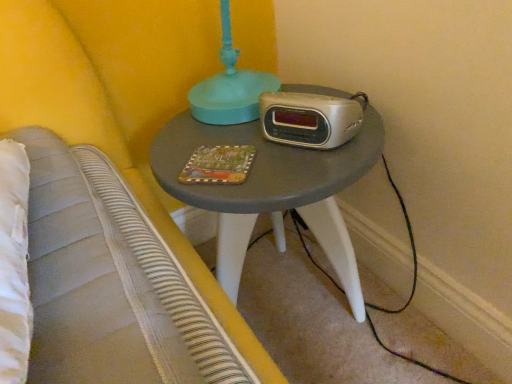
Where is `silver metallic clock radio at center`? silver metallic clock radio at center is located at coordinates (309, 119).

The height and width of the screenshot is (384, 512). Identify the location of silver metallic clock radio at center. (309, 119).

From the image's perspective, which is above, matte gray table at center or silver metallic clock radio at center?

silver metallic clock radio at center appears higher in the image.

From a real-world perspective, is matte gray table at center physically above silver metallic clock radio at center?

No, from a real-world perspective, matte gray table at center is not over silver metallic clock radio at center

Could you tell me if matte gray table at center is turned towards silver metallic clock radio at center?

No, matte gray table at center is not oriented towards silver metallic clock radio at center.

Locate an element on the screen. stereo behind the matte gray table at center is located at coordinates (309, 119).

Considering the sizes of matte gray table at center and matte painted wood book at center in the image, is matte gray table at center wider or thinner than matte painted wood book at center?

matte gray table at center is wider than matte painted wood book at center.

Is matte gray table at center to the right of matte painted wood book at center from the viewer's perspective?

Yes.

Between point (367, 163) and point (211, 161), which one is positioned behind?

The point (211, 161) is more distant.

Considering the sizes of objects matte gray table at center and matte painted wood book at center in the image provided, who is bigger, matte gray table at center or matte painted wood book at center?

Bigger between the two is matte gray table at center.

Is matte painted wood book at center situated inside matte gray table at center or outside?

matte painted wood book at center is inside matte gray table at center.

Considering the sizes of objects matte painted wood book at center and matte gray table at center in the image provided, who is wider, matte painted wood book at center or matte gray table at center?

matte gray table at center is wider.

How different are the orientations of matte painted wood book at center and matte gray table at center in degrees?

49.4 degrees separate the facing orientations of matte painted wood book at center and matte gray table at center.

From the picture: Is matte painted wood book at center to the left of silver metallic clock radio at center from the viewer's perspective?

Yes.

From the picture: From the image's perspective, is matte painted wood book at center located beneath silver metallic clock radio at center?

Correct, matte painted wood book at center appears lower than silver metallic clock radio at center in the image.

Is matte painted wood book at center shorter than silver metallic clock radio at center?

Correct, matte painted wood book at center is not as tall as silver metallic clock radio at center.

Are silver metallic clock radio at center and matte painted wood book at center located far from each other?

That's not correct — silver metallic clock radio at center is a little close to matte painted wood book at center.

Which of these two, silver metallic clock radio at center or matte painted wood book at center, is bigger?

silver metallic clock radio at center.

Is matte painted wood book at center surrounded by silver metallic clock radio at center?

That's incorrect, matte painted wood book at center is not inside silver metallic clock radio at center.

Is silver metallic clock radio at center bigger than matte gray table at center?

No, silver metallic clock radio at center is not bigger than matte gray table at center.

Can you confirm if silver metallic clock radio at center is positioned to the left of matte gray table at center?

No, silver metallic clock radio at center is not to the left of matte gray table at center.

Is silver metallic clock radio at center shorter than matte gray table at center?

Yes, silver metallic clock radio at center is shorter than matte gray table at center.

Identify the location of nightstand lying below the silver metallic clock radio at center (from the image's perspective). (272, 191).

Where is `stereo on the right side of matte gray table at center`? stereo on the right side of matte gray table at center is located at coordinates (309, 119).

Find the location of a particular element. This screenshot has height=384, width=512. book that is behind the matte gray table at center is located at coordinates (218, 165).

From the image, which object appears to be farther from matte gray table at center, matte painted wood book at center or silver metallic clock radio at center?

matte painted wood book at center is further to matte gray table at center.

Estimate the real-world distances between objects in this image. Which object is further from matte painted wood book at center, matte gray table at center or silver metallic clock radio at center?

Among the two, matte gray table at center is located further to matte painted wood book at center.

Looking at the image, which one is located further to silver metallic clock radio at center, matte gray table at center or matte painted wood book at center?

matte gray table at center.

Based on their spatial positions, is silver metallic clock radio at center or matte gray table at center closer to matte painted wood book at center?

silver metallic clock radio at center.

Considering their positions, is silver metallic clock radio at center positioned further to matte gray table at center than matte painted wood book at center?

matte painted wood book at center is further to matte gray table at center.

Considering their positions, is matte painted wood book at center positioned further to silver metallic clock radio at center than matte gray table at center?

matte gray table at center is further to silver metallic clock radio at center.

Locate an element on the screen. book between silver metallic clock radio at center and matte gray table at center from top to bottom is located at coordinates (218, 165).